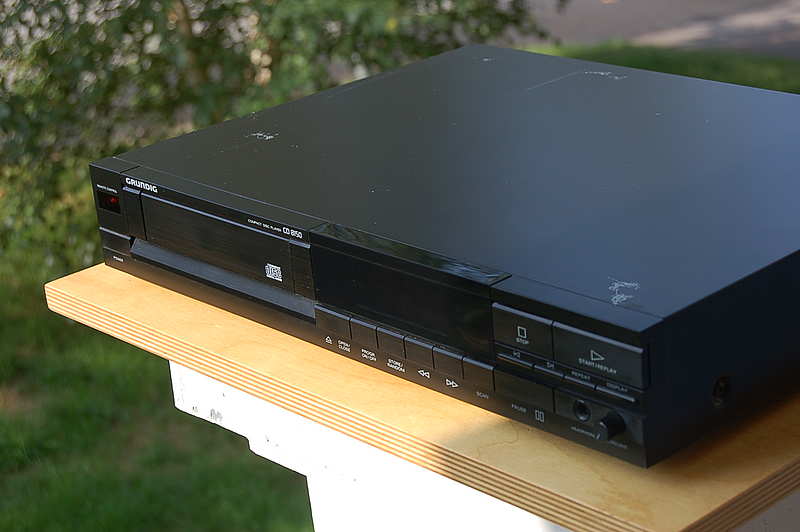
Image resolution: width=800 pixels, height=532 pixels. What are the coordinates of `gray shadow on table surface` in the screenshot? It's located at (598, 470).